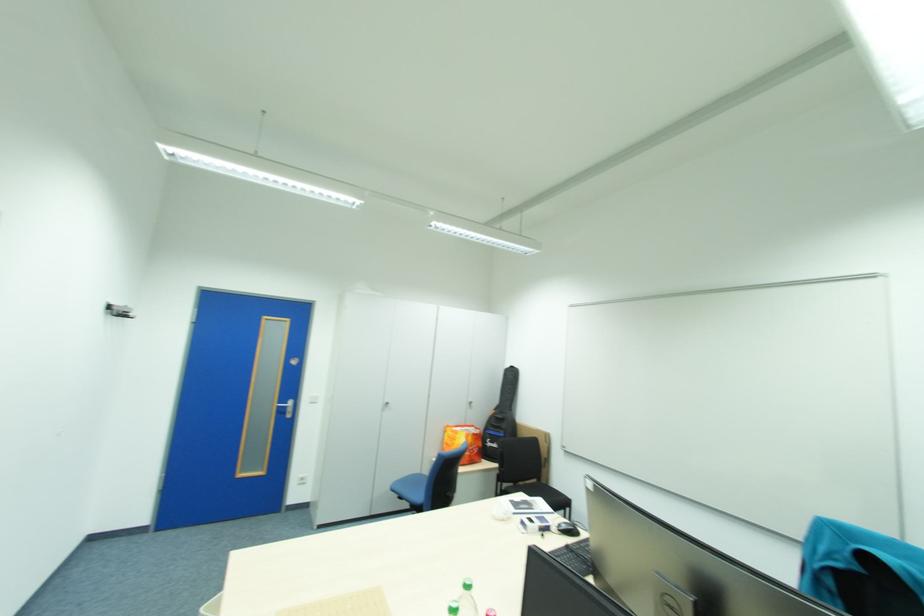
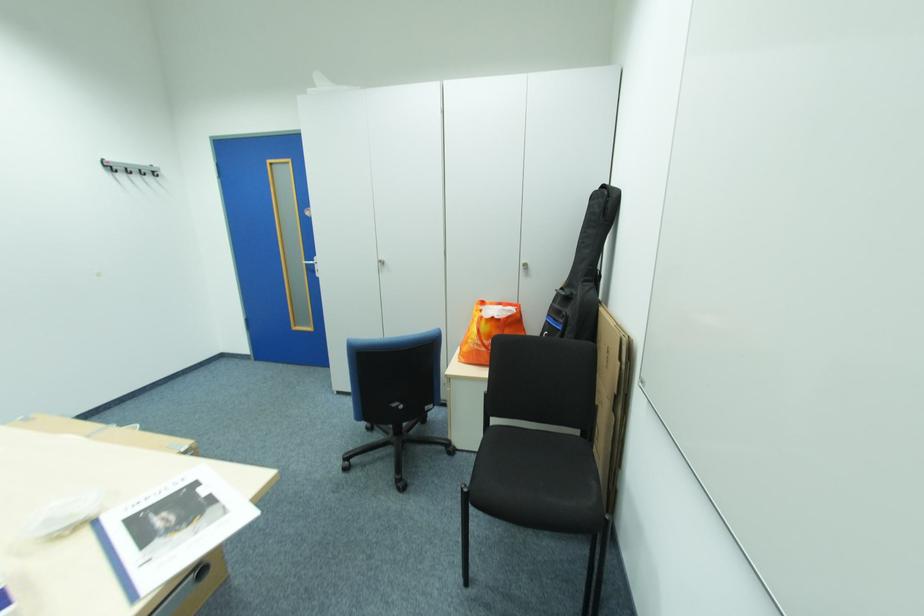
In the second image, find the point that corresponds to point 286,407 in the first image.

(314, 265)